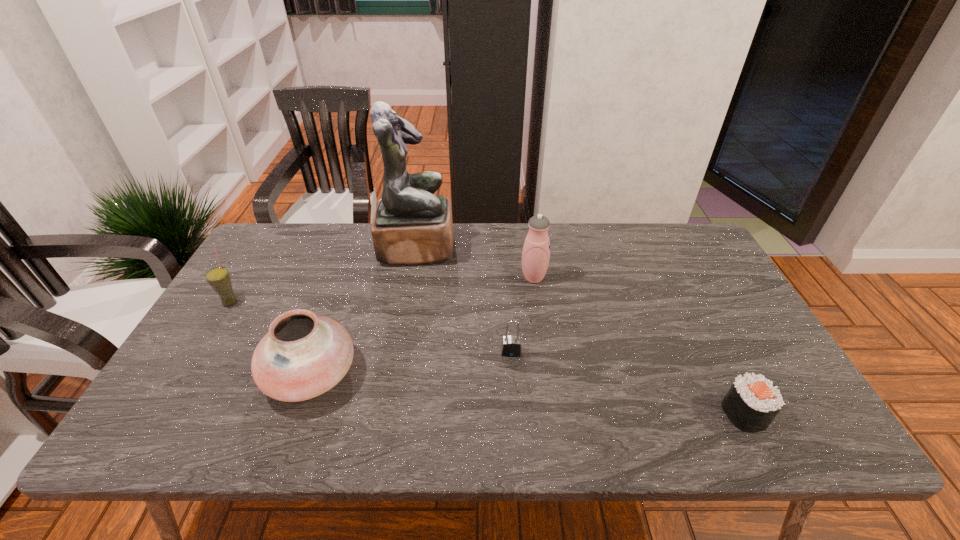
Where is `the tallest object`? The height and width of the screenshot is (540, 960). the tallest object is located at coordinates (411, 226).

This screenshot has width=960, height=540. In order to click on the farthest object in this screenshot , I will do `click(411, 226)`.

The width and height of the screenshot is (960, 540). I want to click on thermos bottle, so click(x=536, y=251).

You are a GUI agent. You are given a task and a screenshot of the screen. Output one action in this format:
    pyautogui.click(x=<x>, y=<y>)
    Task: Click on the fifth object from left to right
    The width and height of the screenshot is (960, 540).
    Given the screenshot: What is the action you would take?
    536,251

Find the location of a particular element. the third farthest object is located at coordinates (219, 279).

Locate an element on the screen. straw for drinking is located at coordinates (219, 279).

Find the location of a particular element. The height and width of the screenshot is (540, 960). pottery is located at coordinates (302, 356).

In order to click on the fourth object from left to right in this screenshot , I will do `click(511, 345)`.

Where is `the second shortest object`? The width and height of the screenshot is (960, 540). the second shortest object is located at coordinates (511, 345).

Identify the location of sushi. The width and height of the screenshot is (960, 540). 752,402.